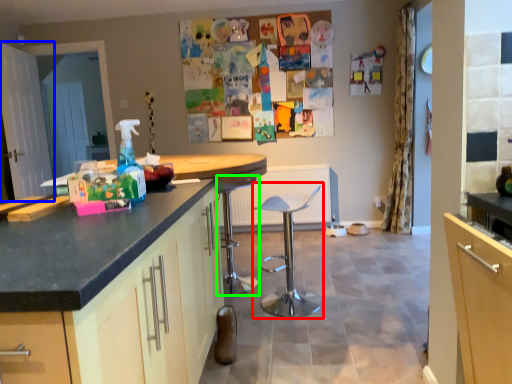
Question: Which object is positioned closest to swivel chair (highlighted by a red box)? Select from screen door (highlighted by a blue box) and bar stool (highlighted by a green box).

Choices:
 (A) screen door
 (B) bar stool

Answer: (B)